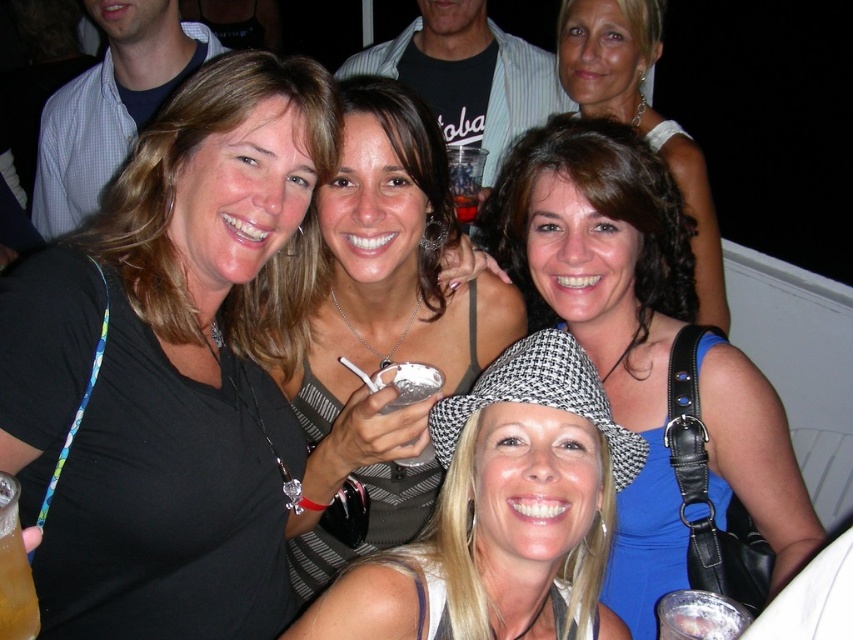
Question: Where is silver metallic phone at center located in relation to clear plastic cup at center in the image?

Choices:
 (A) below
 (B) above

Answer: (A)

Question: Which is farther from the blue fabric dress at center?

Choices:
 (A) clear plastic cup at center
 (B) white matte cupcake at center

Answer: (A)

Question: From the image, what is the correct spatial relationship of blue fabric dress at center in relation to silver metallic phone at center?

Choices:
 (A) below
 (B) above

Answer: (B)

Question: Which of these objects is positioned closest to the black matte shirt at upper left?

Choices:
 (A) brown curly hair at center
 (B) white matte cupcake at center
 (C) silver metallic phone at center
 (D) clear plastic cup at center

Answer: (C)

Question: Is silver metallic phone at center wider than clear plastic cup at center?

Choices:
 (A) yes
 (B) no

Answer: (A)

Question: Which point is closer to the camera taking this photo?

Choices:
 (A) (407, 374)
 (B) (590, 8)
 (C) (468, 205)
 (D) (753, 365)

Answer: (A)